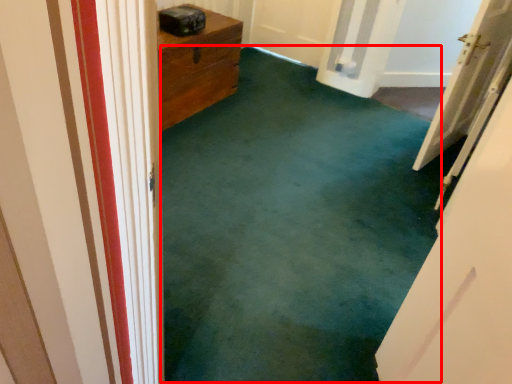
Question: From the image, what is the correct spatial relationship of corridor (annotated by the red box) in relation to door?

Choices:
 (A) right
 (B) left

Answer: (B)